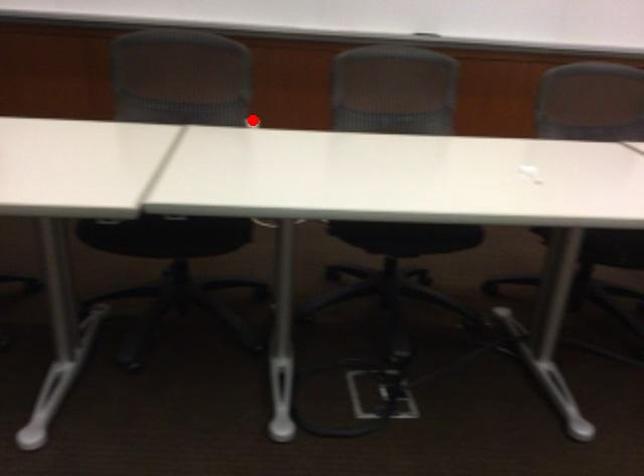
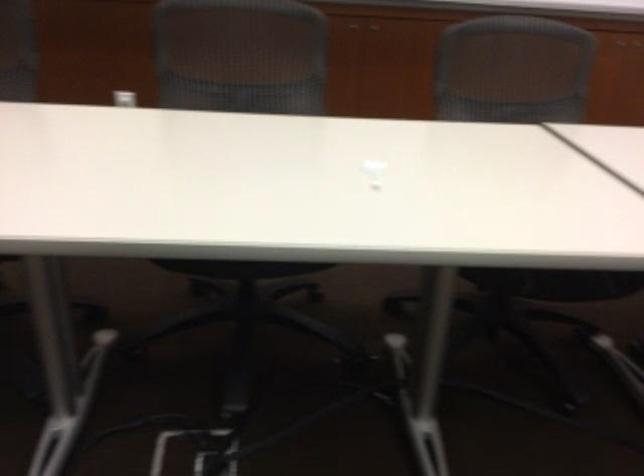
Locate, in the second image, the point that corresponds to the highlighted location in the first image.

(125, 96)